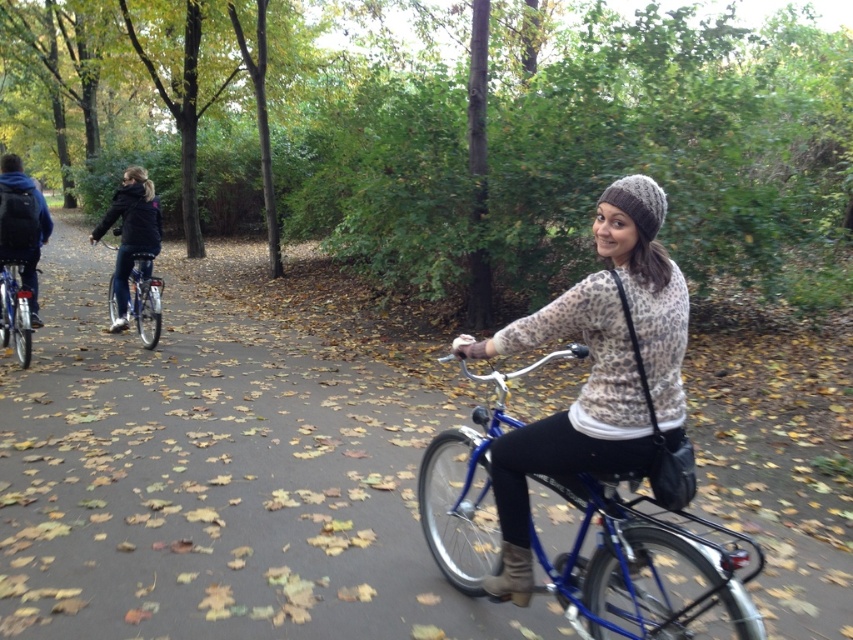
You are a delivery person who needs to choose between the shiny silver bicycle at left and the shiny metallic bicycle at left. Which bicycle is shorter and better suited for navigating narrow park paths?

The shiny silver bicycle at left is shorter than the shiny metallic bicycle at left, making it better suited for navigating narrow park paths.

You are a fashion designer observing the autumn park scene. You notice the leopard print sweater at center and the blue backpack at left. Which item has a narrower width?

The leopard print sweater at center is thinner than the blue backpack at left, so the leopard print sweater at center has a narrower width.

You are a pedestrian walking on the park path and see the blue metallic bicycle at center and the blue backpack at left. Which object is closer to you?

The blue metallic bicycle at center is closer to you because it is in front of the blue backpack at left.